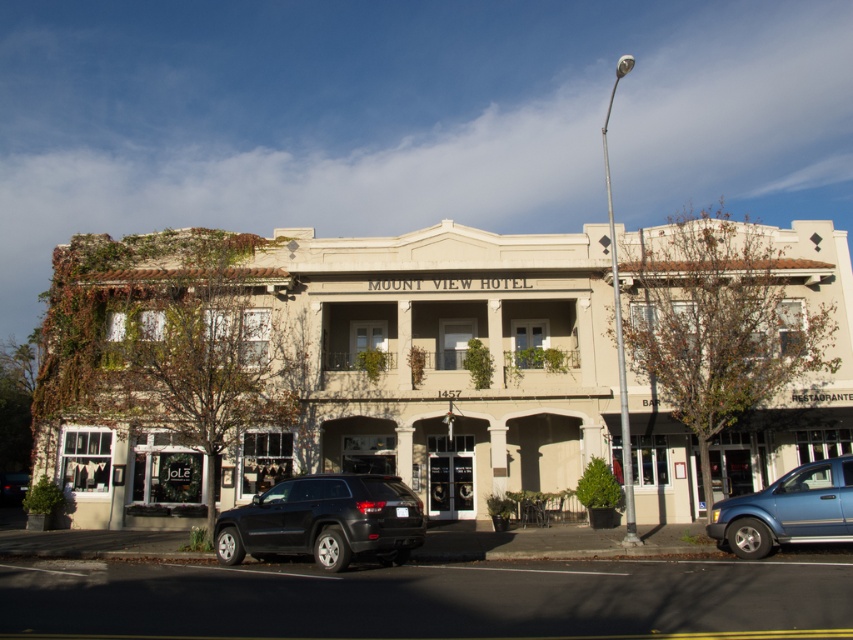
You are standing in front of Mount View Hotel and want to take a photo. You notice two points marked in the image. The first point is at coordinate point (373, 480) and the second point is at coordinate point (827, 536). Which point is closer to you?

Point (373, 480) is closer to you than point (827, 536) because it is further to the viewer according to the description.

You are a delivery driver who needs to park your vehicle in the parking lot behind the Mount View Hotel. You see a black matte suv at center and a blue metallic suv at lower right. Which vehicle should you move to access the parking space behind them?

You should move the black matte suv at center because it is in front of the blue metallic suv at lower right, so moving it would allow access to the parking space behind.